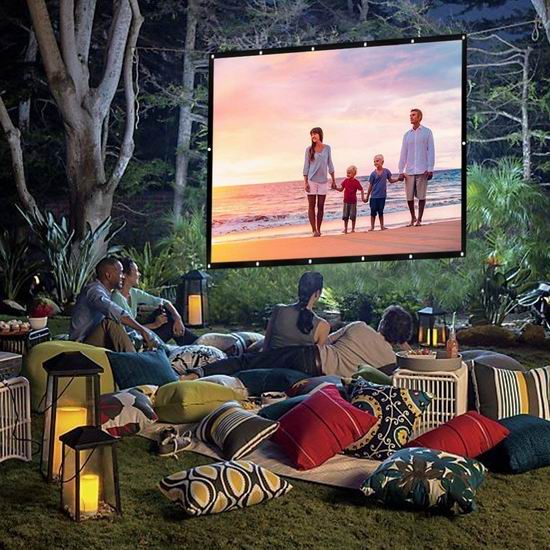
Find the location of a particular element. Image resolution: width=550 pixels, height=550 pixels. candles is located at coordinates (90, 498), (70, 420), (195, 305), (438, 336).